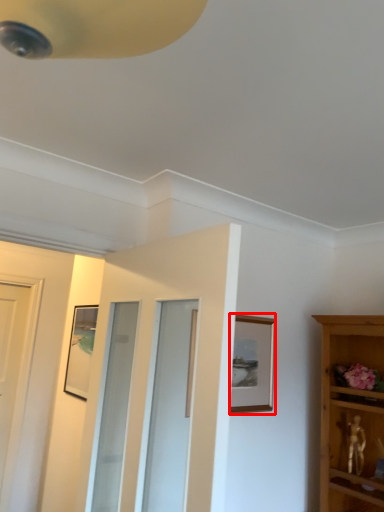
Question: Observing the image, what is the correct spatial positioning of picture frame (annotated by the red box) in reference to door?

Choices:
 (A) left
 (B) right

Answer: (B)